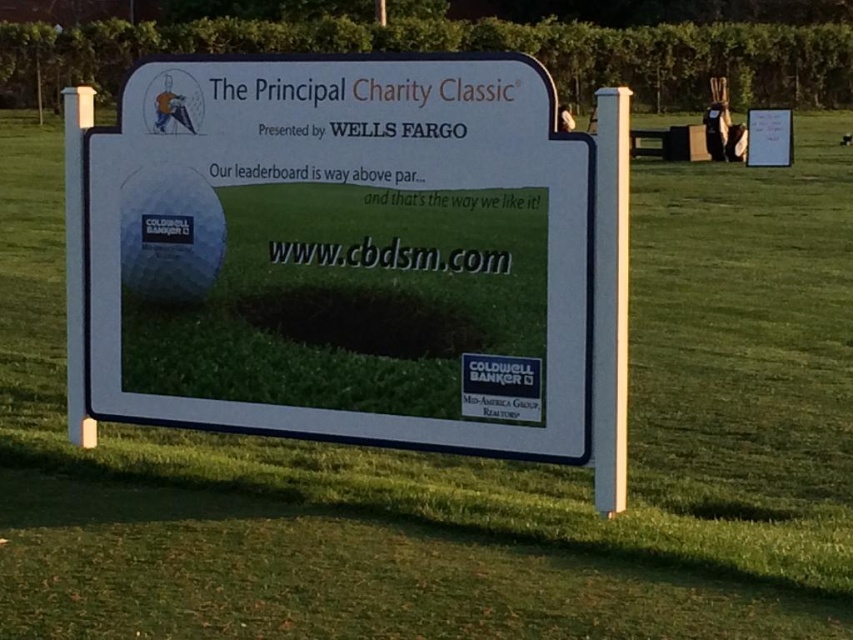
Question: Which point is farther to the camera?

Choices:
 (A) (167, 86)
 (B) (601, 230)

Answer: (A)

Question: Is white plastic sign at center positioned before yellow fabric golfer at upper left?

Choices:
 (A) yes
 (B) no

Answer: (A)

Question: Is white plastic sign at center behind yellow fabric golfer at upper left?

Choices:
 (A) no
 (B) yes

Answer: (A)

Question: Is white plastic sign at center positioned behind yellow fabric golfer at upper left?

Choices:
 (A) yes
 (B) no

Answer: (B)